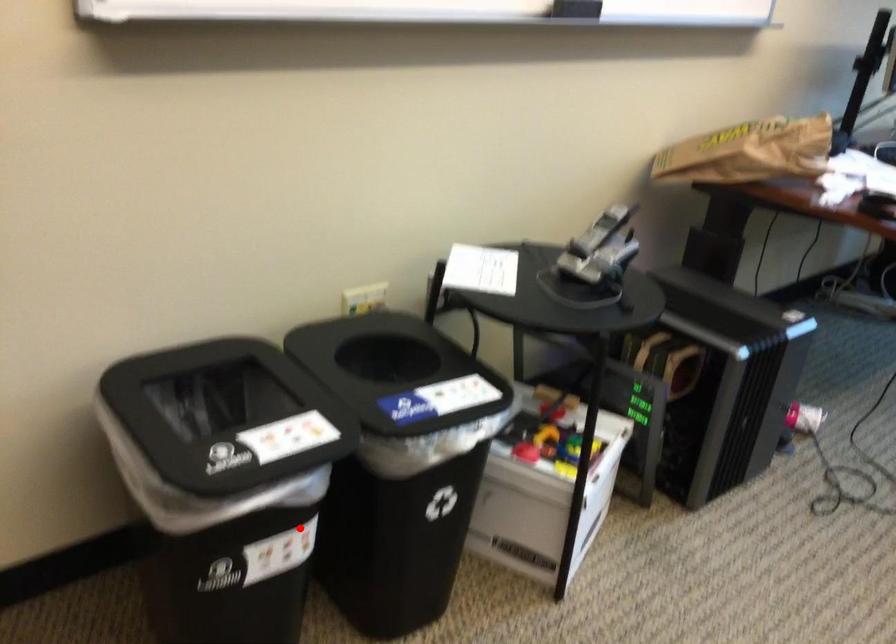
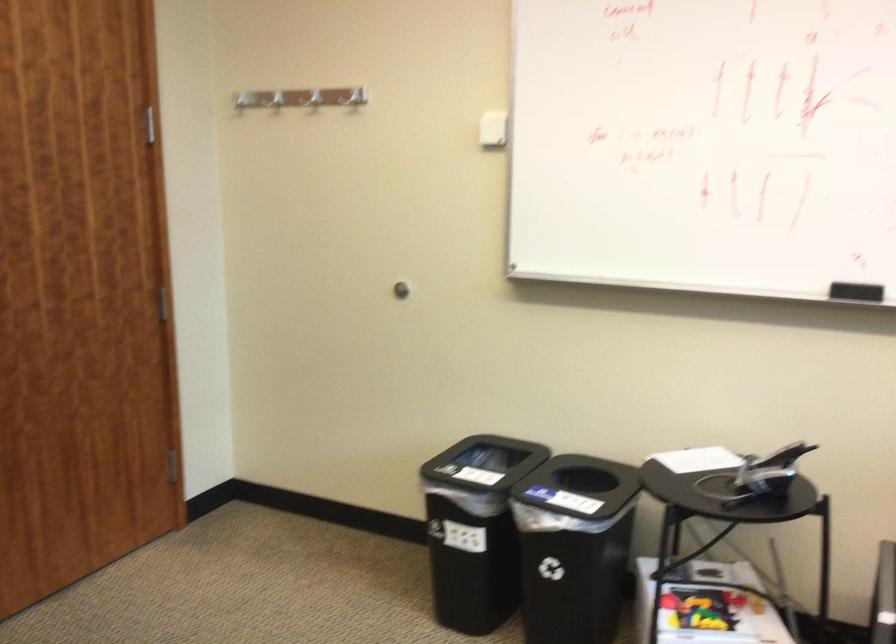
Where in the second image is the point corresponding to the highlighted location from the first image?

(475, 529)